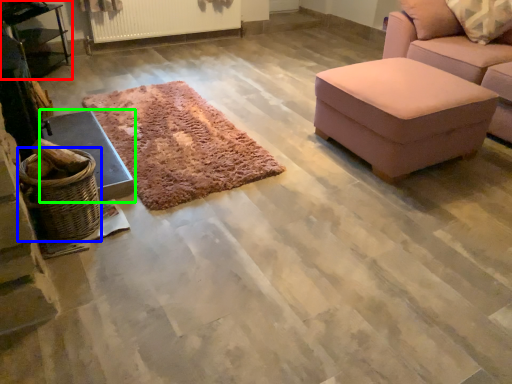
Question: Based on their relative distances, which object is nearer to table (highlighted by a red box)? Choose from basket (highlighted by a blue box) and furniture (highlighted by a green box).

Choices:
 (A) basket
 (B) furniture

Answer: (B)